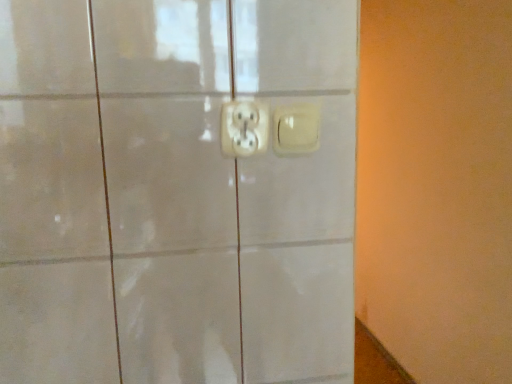
Question: Is matte white switch at center thinner than white plastic power plug and socket at center?

Choices:
 (A) no
 (B) yes

Answer: (A)

Question: Is matte white switch at center completely or partially outside of white plastic power plug and socket at center?

Choices:
 (A) yes
 (B) no

Answer: (A)

Question: Is matte white switch at center at the left side of white plastic power plug and socket at center?

Choices:
 (A) yes
 (B) no

Answer: (B)

Question: Is matte white switch at center positioned with its back to white plastic power plug and socket at center?

Choices:
 (A) yes
 (B) no

Answer: (B)

Question: Can you confirm if matte white switch at center is wider than white plastic power plug and socket at center?

Choices:
 (A) yes
 (B) no

Answer: (A)

Question: Does matte white switch at center have a greater height compared to white plastic power plug and socket at center?

Choices:
 (A) yes
 (B) no

Answer: (B)

Question: Are white plastic power plug and socket at center and matte white switch at center located far from each other?

Choices:
 (A) no
 (B) yes

Answer: (A)

Question: Considering the relative sizes of white plastic power plug and socket at center and matte white switch at center in the image provided, is white plastic power plug and socket at center bigger than matte white switch at center?

Choices:
 (A) no
 (B) yes

Answer: (B)

Question: Is white plastic power plug and socket at center turned away from matte white switch at center?

Choices:
 (A) yes
 (B) no

Answer: (B)

Question: Is white plastic power plug and socket at center smaller than matte white switch at center?

Choices:
 (A) no
 (B) yes

Answer: (A)

Question: Considering the relative sizes of white plastic power plug and socket at center and matte white switch at center in the image provided, is white plastic power plug and socket at center shorter than matte white switch at center?

Choices:
 (A) no
 (B) yes

Answer: (A)

Question: Considering the relative positions of white plastic power plug and socket at center and matte white switch at center in the image provided, is white plastic power plug and socket at center to the left of matte white switch at center from the viewer's perspective?

Choices:
 (A) no
 (B) yes

Answer: (B)

Question: Is white plastic power plug and socket at center inside or outside of matte white switch at center?

Choices:
 (A) inside
 (B) outside

Answer: (B)